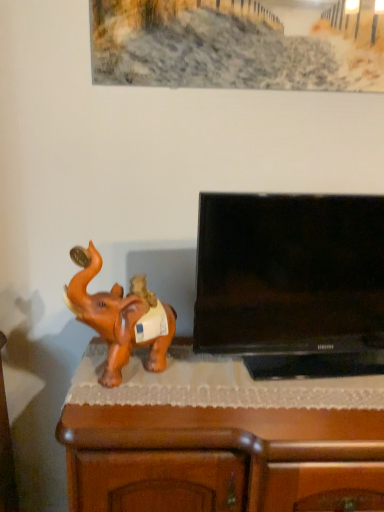
Question: From the image's perspective, is brown wood cabinet at lower left under brown glossy elephant at left?

Choices:
 (A) no
 (B) yes

Answer: (B)

Question: Is the surface of brown wood cabinet at lower left in direct contact with brown glossy elephant at left?

Choices:
 (A) no
 (B) yes

Answer: (A)

Question: Could you tell me if brown wood cabinet at lower left is turned towards brown glossy elephant at left?

Choices:
 (A) yes
 (B) no

Answer: (B)

Question: Would you say brown wood cabinet at lower left contains brown glossy elephant at left?

Choices:
 (A) no
 (B) yes

Answer: (A)

Question: From a real-world perspective, is brown wood cabinet at lower left located beneath brown glossy elephant at left?

Choices:
 (A) yes
 (B) no

Answer: (A)

Question: Can you confirm if brown wood cabinet at lower left is positioned to the right of brown glossy elephant at left?

Choices:
 (A) no
 (B) yes

Answer: (B)

Question: Is brown wood cabinet at lower left closer to camera compared to black glossy flat-screen tv at right?

Choices:
 (A) yes
 (B) no

Answer: (B)

Question: From the image's perspective, is brown wood cabinet at lower left on top of black glossy flat-screen tv at right?

Choices:
 (A) yes
 (B) no

Answer: (B)

Question: From a real-world perspective, is brown wood cabinet at lower left below black glossy flat-screen tv at right?

Choices:
 (A) yes
 (B) no

Answer: (A)

Question: Could you tell me if brown wood cabinet at lower left is turned towards black glossy flat-screen tv at right?

Choices:
 (A) yes
 (B) no

Answer: (B)

Question: Is black glossy flat-screen tv at right at the back of brown wood cabinet at lower left?

Choices:
 (A) no
 (B) yes

Answer: (A)

Question: Is the depth of brown wood cabinet at lower left greater than that of black glossy flat-screen tv at right?

Choices:
 (A) yes
 (B) no

Answer: (A)

Question: Is brown glossy elephant at left aimed at brown wood cabinet at lower left?

Choices:
 (A) no
 (B) yes

Answer: (A)